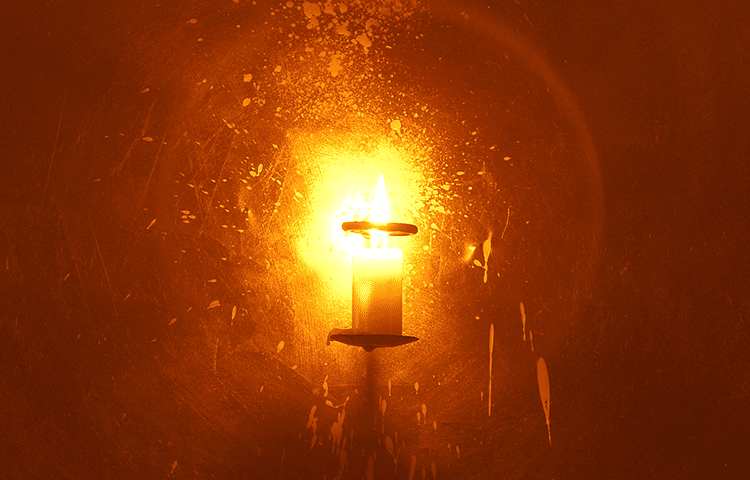
Where is `empty space top corners`? Image resolution: width=750 pixels, height=480 pixels. empty space top corners is located at coordinates (90, 32), (644, 51).